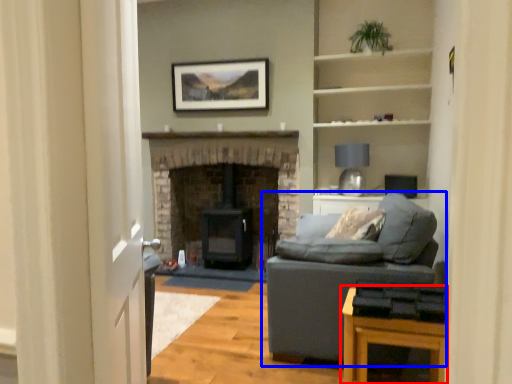
Question: Which object is closer to the camera taking this photo, table (highlighted by a red box) or studio couch (highlighted by a blue box)?

Choices:
 (A) table
 (B) studio couch

Answer: (A)